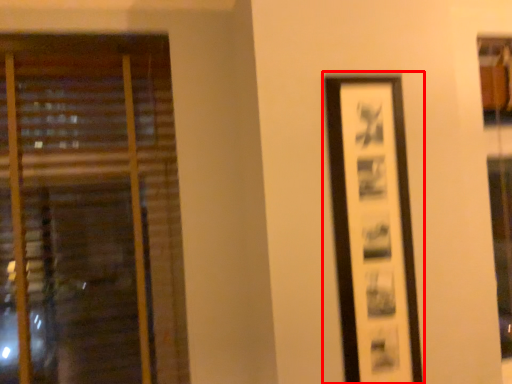
Question: From the image's perspective, considering the relative positions of picture frame (annotated by the red box) and window in the image provided, where is picture frame (annotated by the red box) located with respect to the staircase?

Choices:
 (A) below
 (B) above

Answer: (B)